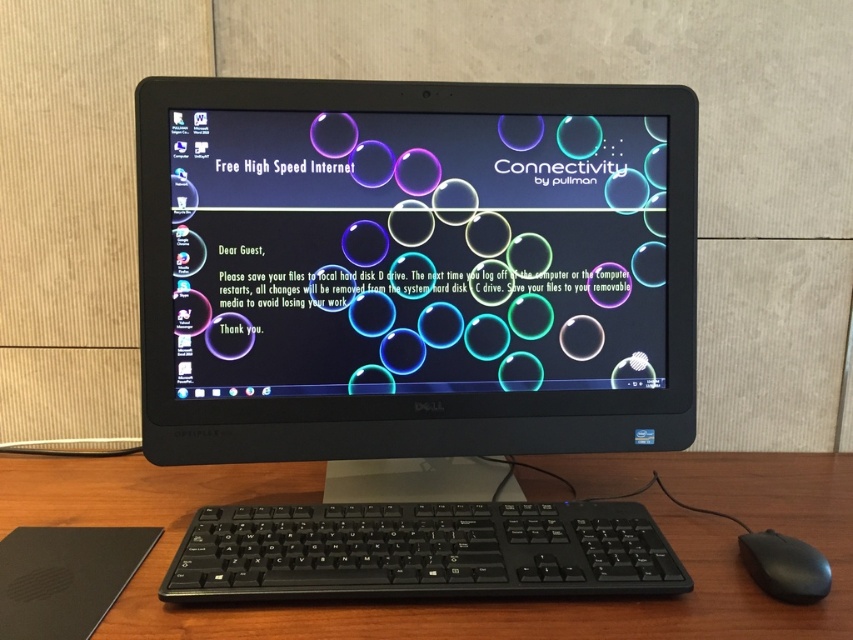
Question: Does black glossy monitor at center appear on the right side of black plastic keyboard at center?

Choices:
 (A) no
 (B) yes

Answer: (A)

Question: Observing the image, what is the correct spatial positioning of black plastic keyboard at center in reference to black plastic mouse at lower right?

Choices:
 (A) right
 (B) left

Answer: (B)

Question: Based on their relative distances, which object is nearer to the wooden at center?

Choices:
 (A) black plastic mouse at lower right
 (B) black plastic keyboard at center
 (C) black glossy monitor at center

Answer: (B)

Question: Which point is closer to the camera taking this photo?

Choices:
 (A) (370, 284)
 (B) (294, 595)
 (C) (567, 493)
 (D) (796, 589)

Answer: (B)

Question: Which point is farther to the camera?

Choices:
 (A) (764, 545)
 (B) (305, 307)
 (C) (549, 460)
 (D) (540, 525)

Answer: (C)

Question: Is wooden at center positioned behind black plastic mouse at lower right?

Choices:
 (A) no
 (B) yes

Answer: (A)